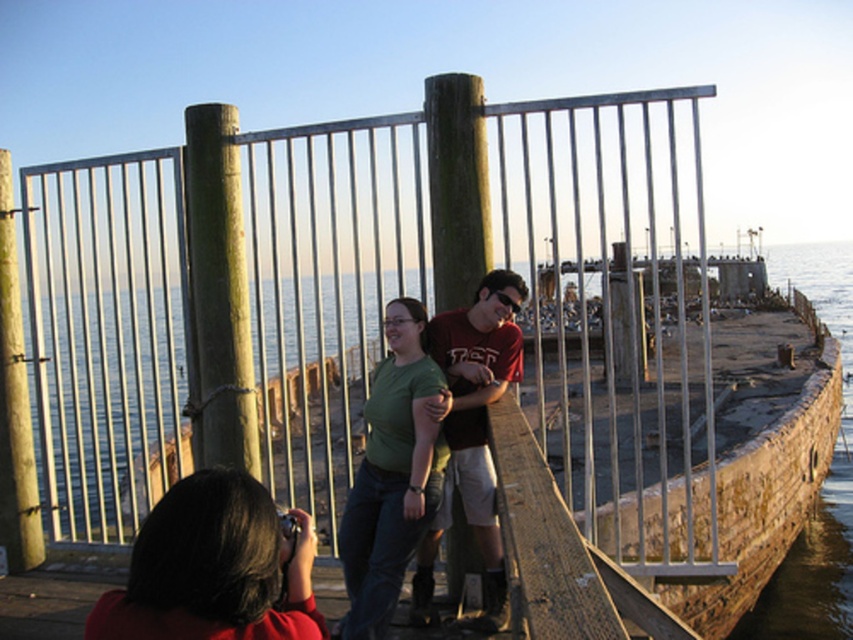
You are standing at the edge of the promenade and want to find the metallic gate at center. According to the coordinates provided, where should you look to locate it?

The metallic gate at center is located at the 2D coordinates point (375, 307), so you should look towards the center of the image to find it.

You are standing on the seaside promenade and see two points marked in the image. Which point is closer to you, point (93, 344) or point (143, 625)?

Point (93, 344) is closer to you because it is further to the viewer than point (143, 625).